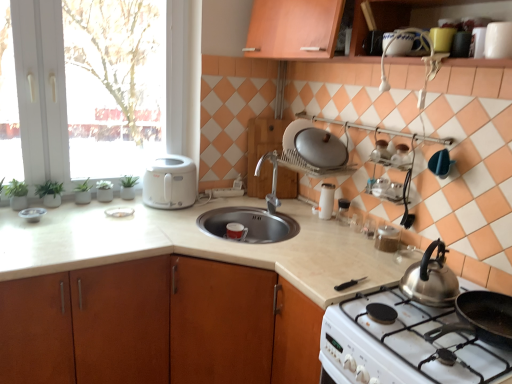
This screenshot has height=384, width=512. I want to click on free space to the left of white plastic toaster at left, which is the third kitchen appliance in right-to-left order, so (114, 201).